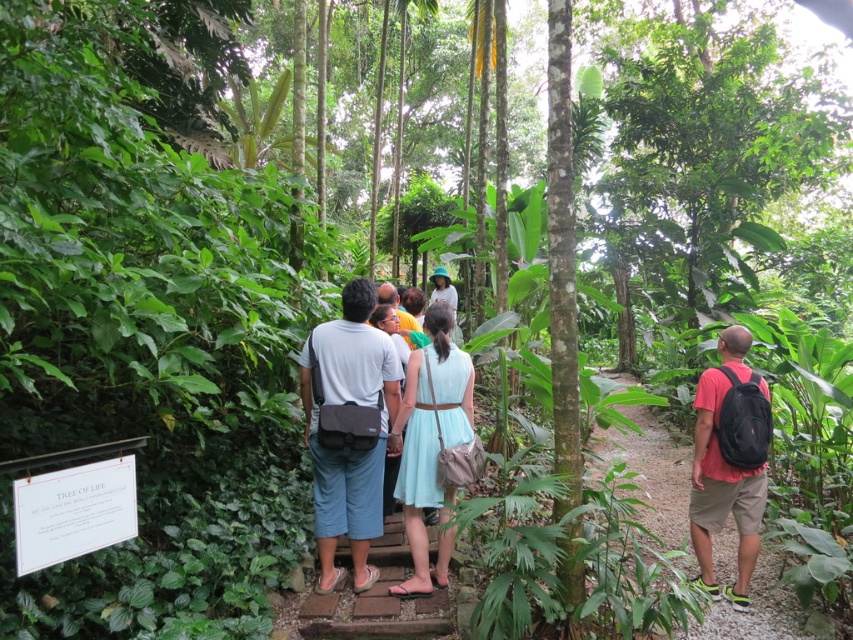
This screenshot has width=853, height=640. What do you see at coordinates (729, 460) in the screenshot? I see `matte black backpack at right` at bounding box center [729, 460].

Who is higher up, matte black backpack at right or red backpack at right?

matte black backpack at right is higher up.

The image size is (853, 640). What are the coordinates of `matte black backpack at right` in the screenshot? It's located at (729, 460).

Based on the photo, which of these two, gray fabric bag at center or red backpack at right, stands shorter?

Standing shorter between the two is red backpack at right.

Who is more forward, (380, 520) or (677, 483)?

Point (380, 520)

Does point (341, 342) come farther from viewer compared to point (642, 464)?

That is False.

Image resolution: width=853 pixels, height=640 pixels. I want to click on gray fabric bag at center, so click(347, 429).

Can you confirm if matte black backpack at right is positioned to the right of light blue fabric dress at center?

Indeed, matte black backpack at right is positioned on the right side of light blue fabric dress at center.

Which is more to the right, matte black backpack at right or light blue fabric dress at center?

From the viewer's perspective, matte black backpack at right appears more on the right side.

Who is more distant from viewer, (701, 538) or (434, 358)?

The point (701, 538) is more distant.

I want to click on matte black backpack at right, so click(x=729, y=460).